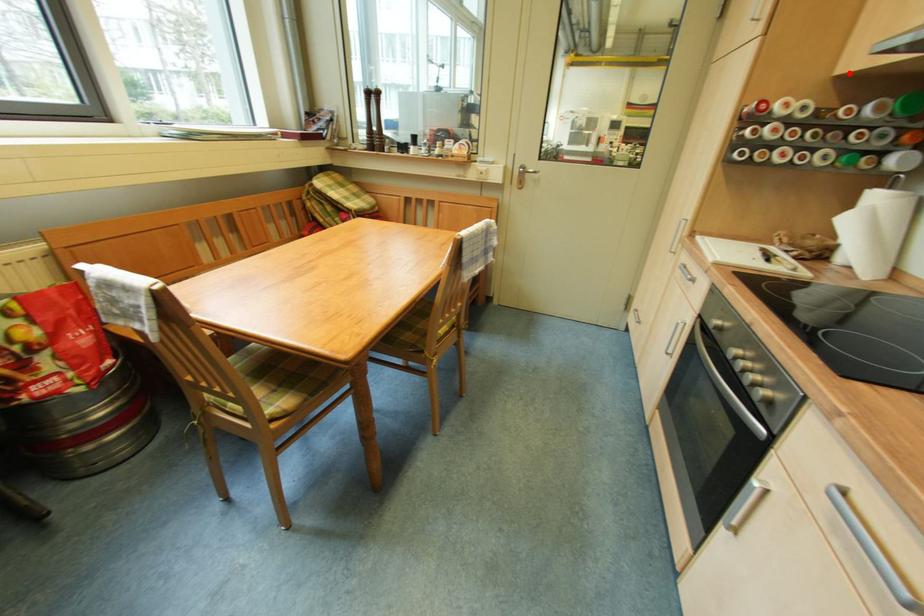
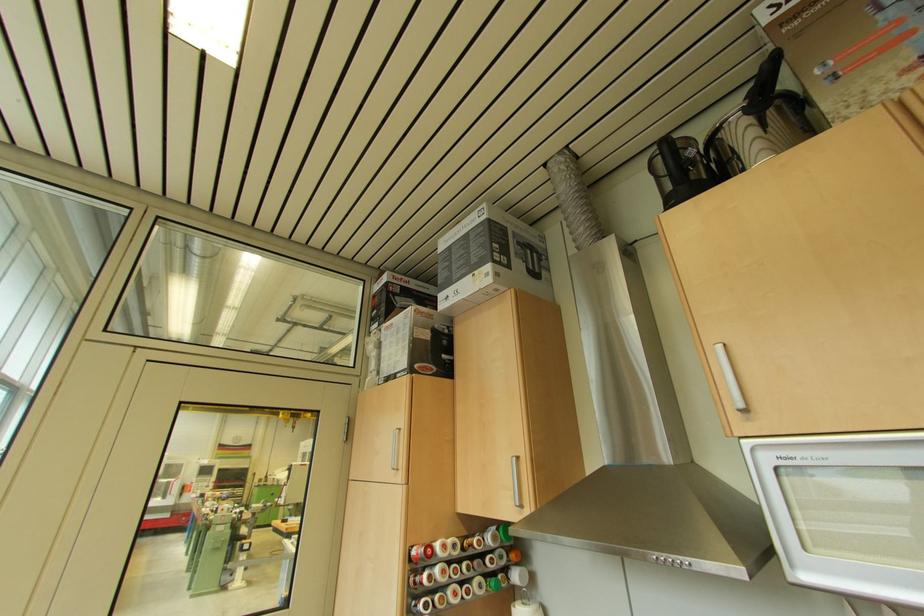
Find the pixel in the second image that matches the highlighted location in the first image.

(468, 513)